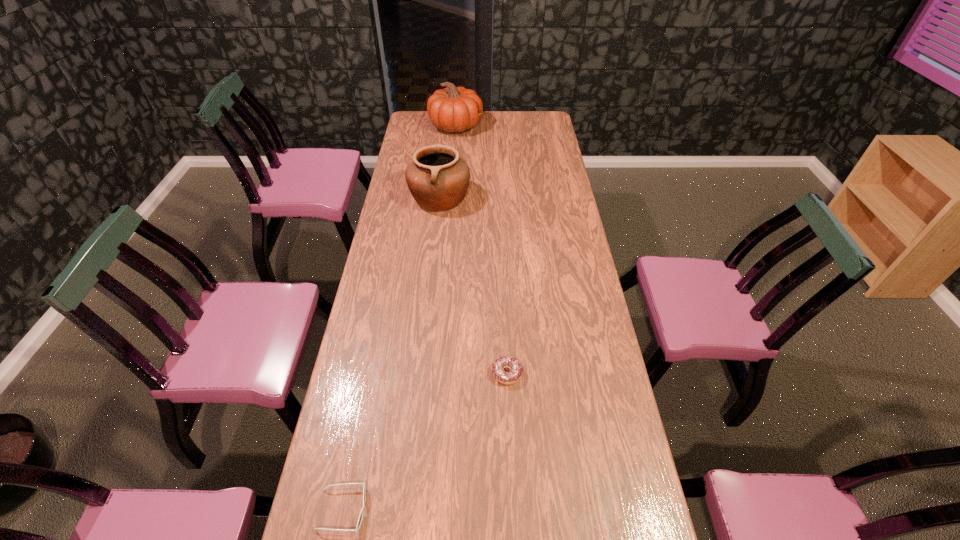
The height and width of the screenshot is (540, 960). Find the location of `pumpkin`. pumpkin is located at coordinates (453, 109).

Image resolution: width=960 pixels, height=540 pixels. I want to click on the third nearest object, so click(438, 179).

This screenshot has width=960, height=540. What are the coordinates of `the rightmost object` in the screenshot? It's located at (511, 377).

This screenshot has width=960, height=540. In order to click on doughnut in this screenshot , I will do `click(511, 377)`.

Find the location of a particular element. Image resolution: width=960 pixels, height=540 pixels. the nearest object is located at coordinates (x=360, y=518).

This screenshot has width=960, height=540. Identify the location of free space located on the face of the farthest object. (501, 126).

Locate an element on the screen. Image resolution: width=960 pixels, height=540 pixels. vacant space located 0.320m on the back of the pottery is located at coordinates (x=445, y=145).

Where is `free space located 0.150m on the back of the second nearest object`? The image size is (960, 540). free space located 0.150m on the back of the second nearest object is located at coordinates (504, 322).

Identify the location of vacant space located 0.390m with the lenses of the nearest object facing outward. (528, 509).

Find the location of `object located at the far edge`. object located at the far edge is located at coordinates (453, 109).